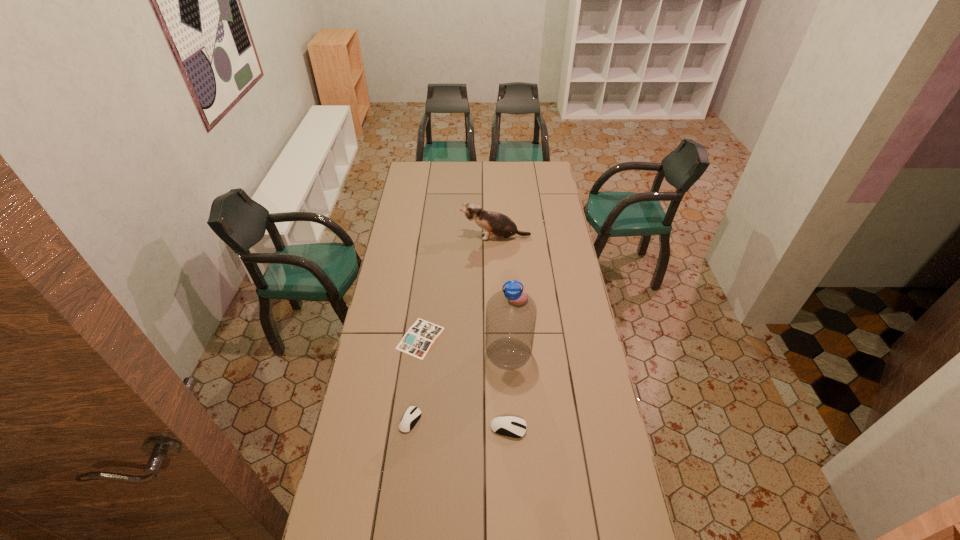
Identify the location of the left mouse. The width and height of the screenshot is (960, 540). (411, 416).

Where is `the taller mouse`? The width and height of the screenshot is (960, 540). the taller mouse is located at coordinates (511, 426).

This screenshot has width=960, height=540. Find the location of `the second farthest object`. the second farthest object is located at coordinates (521, 289).

Where is `the fifth shortest object`? Image resolution: width=960 pixels, height=540 pixels. the fifth shortest object is located at coordinates (497, 226).

Locate an element on the screen. The width and height of the screenshot is (960, 540). the farthest object is located at coordinates (497, 226).

Find the location of `the shortest object`. the shortest object is located at coordinates (420, 337).

Find the location of a particular element. water jug is located at coordinates (511, 313).

Find the location of a particular element. The height and width of the screenshot is (540, 960). vacant region located 0.180m on the back of the left mouse is located at coordinates (417, 366).

You are a GUI agent. You are given a task and a screenshot of the screen. Output one action in this format:
    pyautogui.click(x=<x>, y=<y>)
    Task: Click on the blank space located 0.240m on the back of the right mouse
    This screenshot has width=960, height=540.
    Given the screenshot: What is the action you would take?
    pyautogui.click(x=505, y=362)

Identify the location of free space located on the back of the second farthest object. coord(516,285).